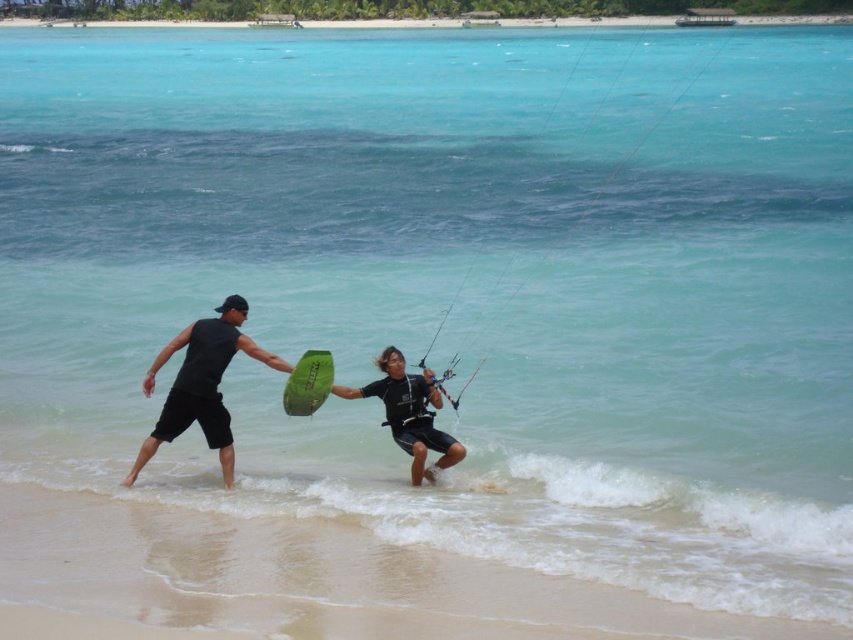
Question: Which point appears farthest from the camera in this image?

Choices:
 (A) (281, 365)
 (B) (335, 388)
 (C) (144, 385)

Answer: (C)

Question: Can you confirm if sandy beach at lower center is positioned below black matte shorts at center?

Choices:
 (A) yes
 (B) no

Answer: (A)

Question: Does sandy beach at lower center appear over matte black wetsuit at center?

Choices:
 (A) yes
 (B) no

Answer: (B)

Question: Which object appears closest to the camera in this image?

Choices:
 (A) sandy beach at lower center
 (B) black matte shorts at center
 (C) matte black wetsuit at center
 (D) green matte surfboard at center

Answer: (A)

Question: Estimate the real-world distances between objects in this image. Which object is closer to the black matte shorts at center?

Choices:
 (A) matte black wetsuit at center
 (B) sandy beach at lower center
 (C) green matte surfboard at center

Answer: (C)

Question: Is green matte surfboard at center wider than matte black wetsuit at center?

Choices:
 (A) no
 (B) yes

Answer: (B)